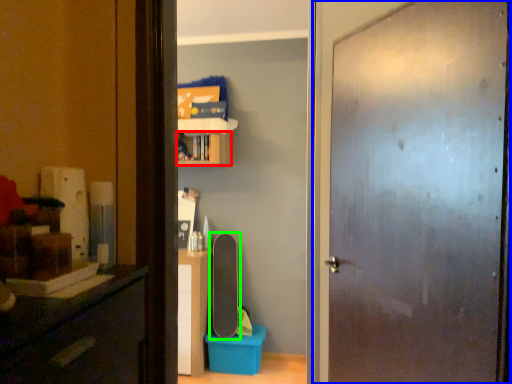
Question: Which object is positioned closest to cabinet (highlighted by a red box)? Select from door (highlighted by a blue box) and skateboard (highlighted by a green box).

Choices:
 (A) door
 (B) skateboard

Answer: (B)